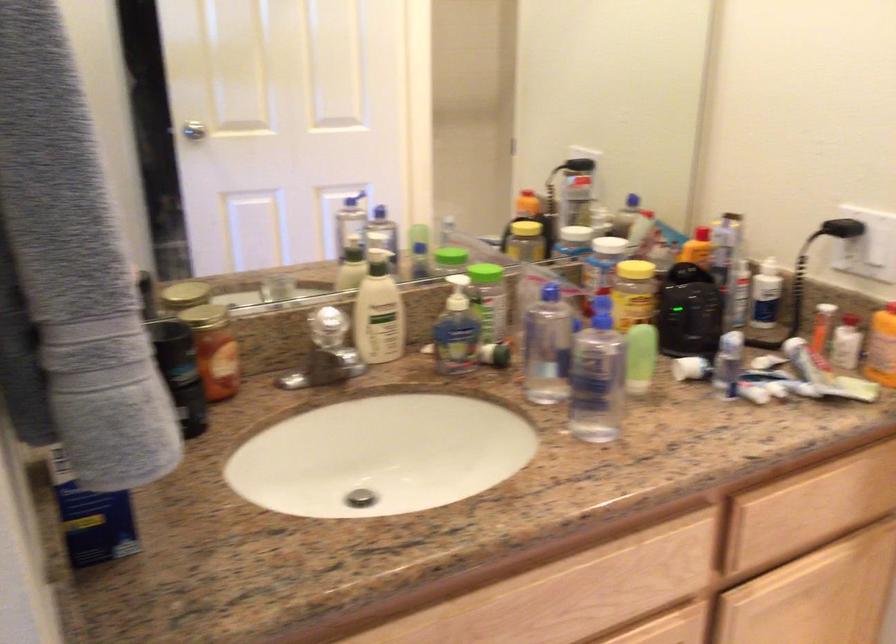
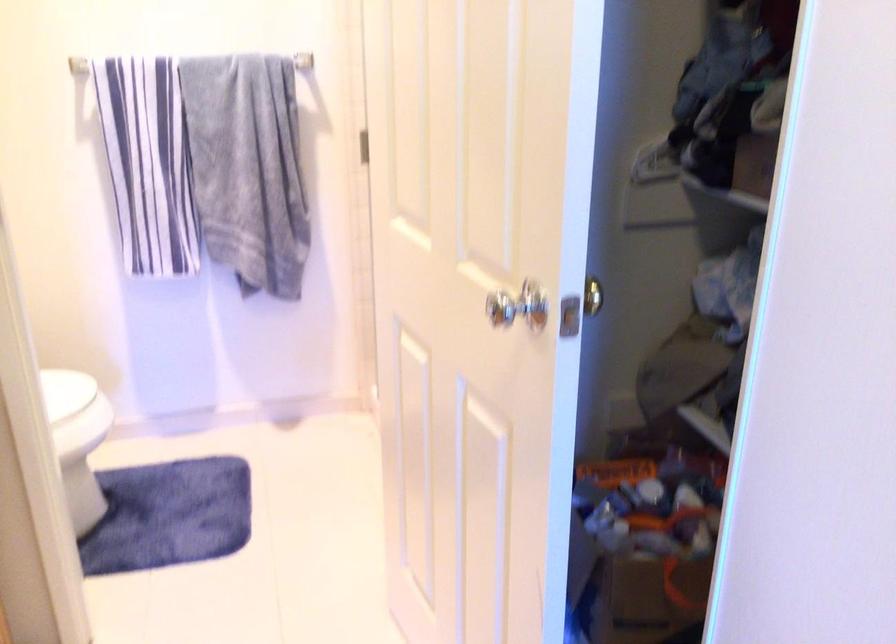
Question: The camera is either moving clockwise (left) or counter-clockwise (right) around the object. The first image is from the beginning of the video and the second image is from the end. Is the camera moving left or right when shooting the video?

Choices:
 (A) Left
 (B) Right

Answer: (A)